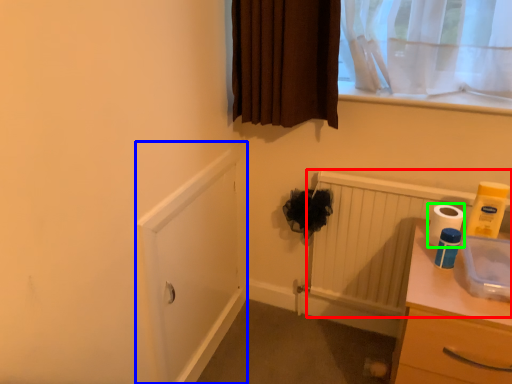
Question: Considering the real-world distances, which object is closest to radiator (highlighted by a red box)? screen door (highlighted by a blue box) or toilet paper (highlighted by a green box).

Choices:
 (A) screen door
 (B) toilet paper

Answer: (B)